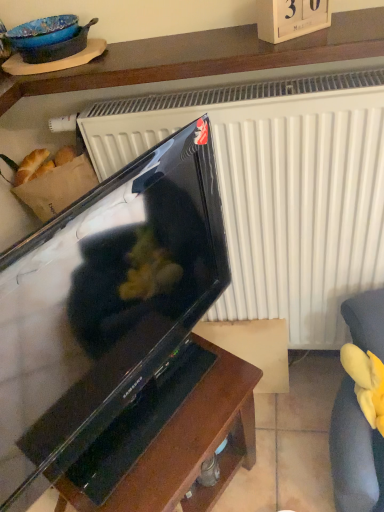
Question: Considering the relative sizes of black glossy television at center and yellow plush toy at lower right in the image provided, is black glossy television at center wider than yellow plush toy at lower right?

Choices:
 (A) yes
 (B) no

Answer: (B)

Question: Are black glossy television at center and yellow plush toy at lower right located far from each other?

Choices:
 (A) yes
 (B) no

Answer: (B)

Question: From the image's perspective, is black glossy television at center over yellow plush toy at lower right?

Choices:
 (A) yes
 (B) no

Answer: (A)

Question: From a real-world perspective, is black glossy television at center over yellow plush toy at lower right?

Choices:
 (A) yes
 (B) no

Answer: (A)

Question: Considering the relative sizes of black glossy television at center and yellow plush toy at lower right in the image provided, is black glossy television at center shorter than yellow plush toy at lower right?

Choices:
 (A) no
 (B) yes

Answer: (A)

Question: Do you think wooden shelf at upper center is within black glossy television at center, or outside of it?

Choices:
 (A) inside
 (B) outside

Answer: (B)

Question: In the image, is wooden shelf at upper center positioned in front of or behind black glossy television at center?

Choices:
 (A) front
 (B) behind

Answer: (B)

Question: From their relative heights in the image, would you say wooden shelf at upper center is taller or shorter than black glossy television at center?

Choices:
 (A) short
 (B) tall

Answer: (A)

Question: In terms of width, does wooden shelf at upper center look wider or thinner when compared to black glossy television at center?

Choices:
 (A) wide
 (B) thin

Answer: (A)

Question: Based on their sizes in the image, would you say wooden shelf at upper center is bigger or smaller than yellow plush toy at lower right?

Choices:
 (A) big
 (B) small

Answer: (A)

Question: Is wooden shelf at upper center to the left or to the right of yellow plush toy at lower right in the image?

Choices:
 (A) left
 (B) right

Answer: (A)

Question: Relative to yellow plush toy at lower right, is wooden shelf at upper center in front or behind?

Choices:
 (A) front
 (B) behind

Answer: (A)

Question: Is wooden shelf at upper center inside or outside of yellow plush toy at lower right?

Choices:
 (A) inside
 (B) outside

Answer: (B)

Question: From the image's perspective, relative to brown wood table at center, is wooden shelf at upper center above or below?

Choices:
 (A) above
 (B) below

Answer: (A)

Question: Considering their positions, is wooden shelf at upper center located in front of or behind brown wood table at center?

Choices:
 (A) front
 (B) behind

Answer: (A)